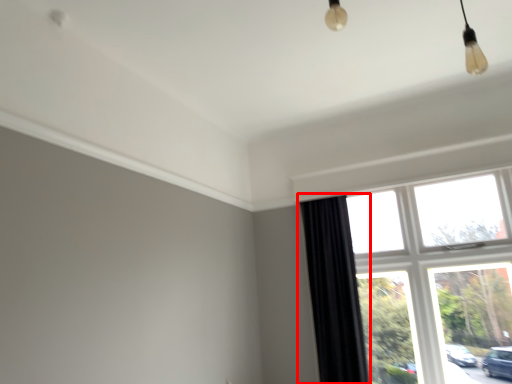
Question: From the image's perspective, what is the correct spatial positioning of curtain (annotated by the red box) in reference to window?

Choices:
 (A) above
 (B) below

Answer: (B)